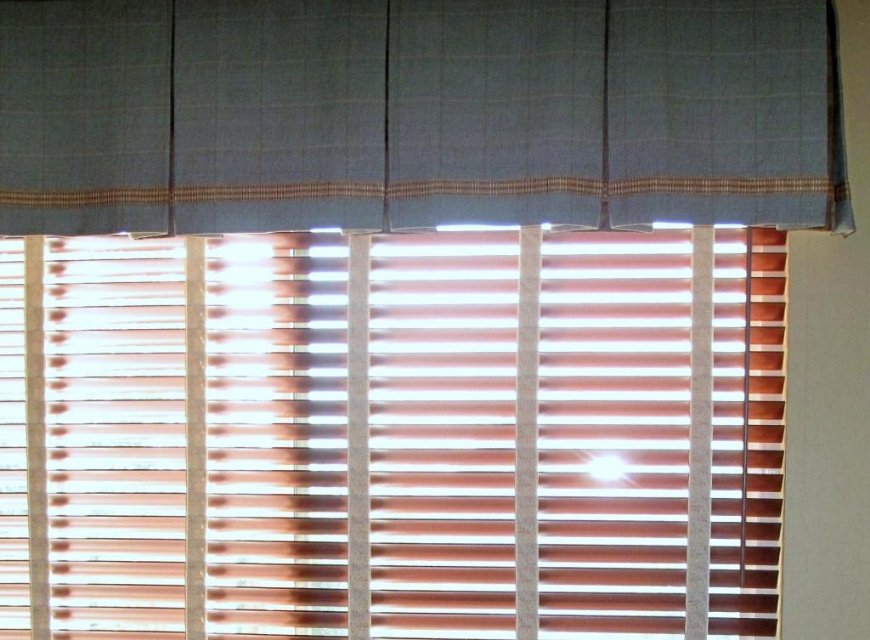
Question: Does wooden blinds at center appear over textured gray curtain at upper center?

Choices:
 (A) yes
 (B) no

Answer: (B)

Question: Where is wooden blinds at center located in relation to textured gray curtain at upper center in the image?

Choices:
 (A) left
 (B) right

Answer: (A)

Question: Which of the following is the farthest from the observer?

Choices:
 (A) wooden blinds at center
 (B) textured gray curtain at upper center

Answer: (A)

Question: Which of the following is the closest to the observer?

Choices:
 (A) (283, 605)
 (B) (437, 84)

Answer: (B)

Question: Is wooden blinds at center closer to the viewer compared to textured gray curtain at upper center?

Choices:
 (A) no
 (B) yes

Answer: (A)